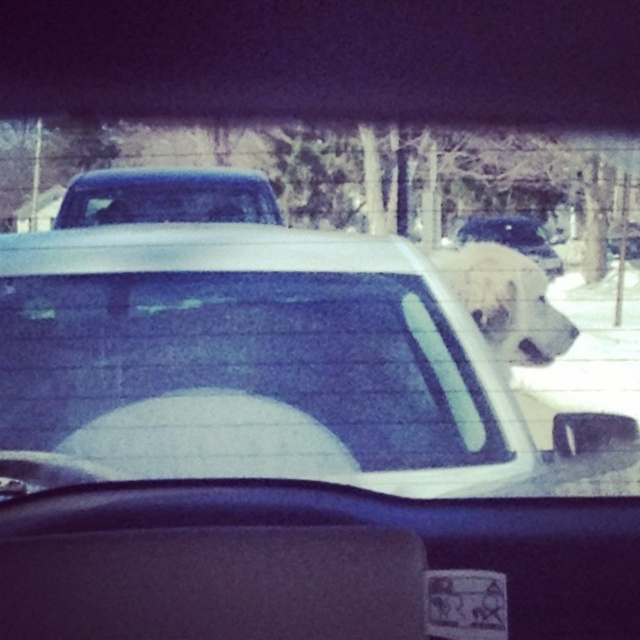
From the picture: Who is positioned more to the right, transparent glass window at center or white plastic license plate at center?

From the viewer's perspective, white plastic license plate at center appears more on the right side.

Describe the element at coordinates (248, 376) in the screenshot. I see `transparent glass window at center` at that location.

This screenshot has width=640, height=640. Find the location of `transparent glass window at center`. transparent glass window at center is located at coordinates (248, 376).

Is white plastic license plate at center above white matte dog at upper right?

No.

Is white plastic license plate at center wider than white matte dog at upper right?

No, white plastic license plate at center is not wider than white matte dog at upper right.

Where is `white plastic license plate at center`? The height and width of the screenshot is (640, 640). white plastic license plate at center is located at coordinates (465, 604).

Identify the location of white plastic license plate at center. This screenshot has width=640, height=640. (465, 604).

Which is more to the right, clear glass window at upper center or white plastic license plate at center?

From the viewer's perspective, white plastic license plate at center appears more on the right side.

Between clear glass window at upper center and white plastic license plate at center, which one appears on the left side from the viewer's perspective?

clear glass window at upper center

Is point (92, 193) positioned before point (488, 627)?

No, (92, 193) is further to viewer.

Locate an element on the screen. The width and height of the screenshot is (640, 640). clear glass window at upper center is located at coordinates (168, 202).